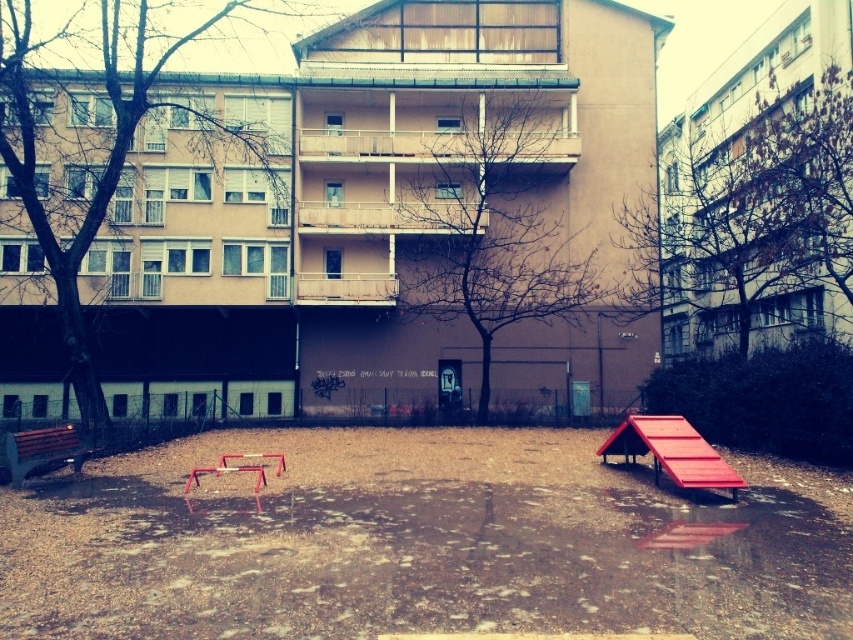
Question: Which object appears farthest from the camera in this image?

Choices:
 (A) smooth wooden ramp at lower right
 (B) metallic red bench at lower center
 (C) brown wooden bench at lower left

Answer: (C)

Question: Is brown wooden bench at lower left above metallic red bench at lower center?

Choices:
 (A) yes
 (B) no

Answer: (A)

Question: Is brown wooden bench at lower left closer to the viewer compared to metallic silver bench at center?

Choices:
 (A) no
 (B) yes

Answer: (B)

Question: Which point is closer to the camera?

Choices:
 (A) (277, 461)
 (B) (683, 426)
 (C) (221, 468)
 (D) (4, 440)

Answer: (B)

Question: Which point is closer to the camera?

Choices:
 (A) smooth wooden ramp at lower right
 (B) metallic red bench at lower center
 (C) brown wooden bench at lower left
 (D) metallic silver bench at center

Answer: (A)

Question: Can you confirm if smooth wooden ramp at lower right is smaller than brown wooden bench at lower left?

Choices:
 (A) no
 (B) yes

Answer: (A)